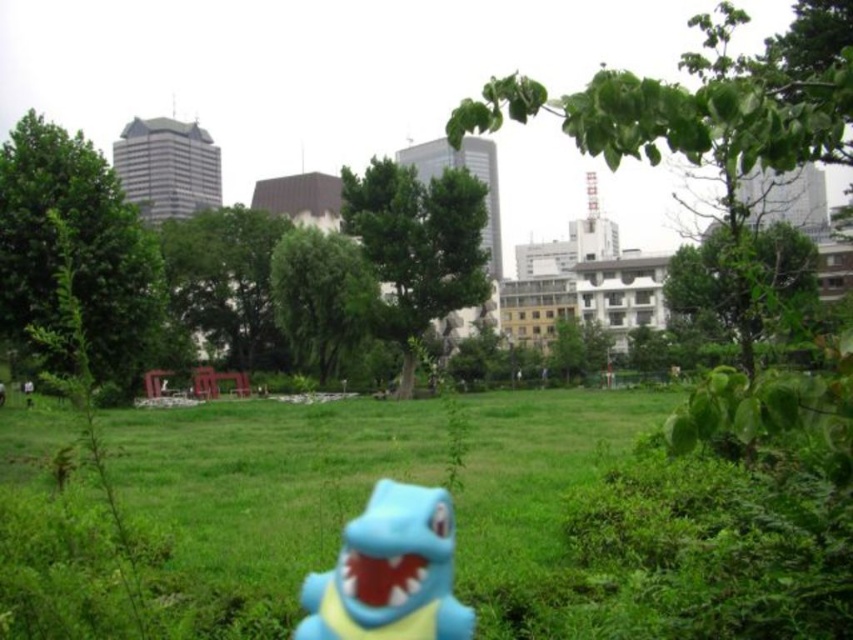
Question: Does green grass at center appear on the right side of blue rubber toy at center?

Choices:
 (A) yes
 (B) no

Answer: (A)

Question: Which of the following is the closest to the observer?

Choices:
 (A) blue rubber toy at center
 (B) green grass at center

Answer: (A)

Question: Is green grass at center to the left of blue rubber toy at center from the viewer's perspective?

Choices:
 (A) yes
 (B) no

Answer: (B)

Question: Which point appears closest to the camera in this image?

Choices:
 (A) (302, 525)
 (B) (386, 492)

Answer: (B)

Question: Can you confirm if green grass at center is smaller than blue rubber toy at center?

Choices:
 (A) yes
 (B) no

Answer: (B)